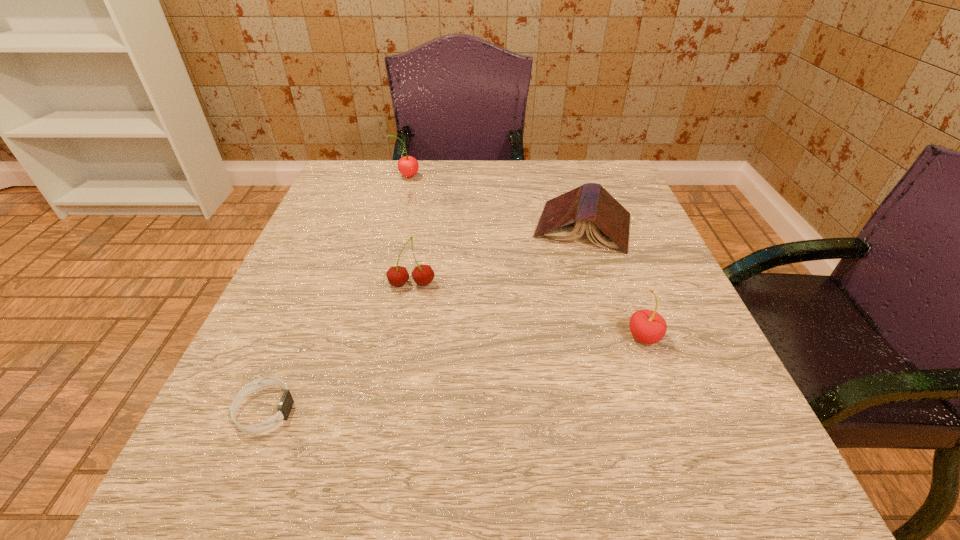
Where is `vacant space located on the front of the rightmost cherry`? vacant space located on the front of the rightmost cherry is located at coordinates (672, 413).

At what (x,y) coordinates should I click in order to perform the action: click on vacant space located on the back of the fourth tallest object. Please return your answer as a coordinate pair (x, y). This screenshot has height=540, width=960. Looking at the image, I should click on (568, 180).

Where is `vacant position located on the outer surface of the nearest object`? vacant position located on the outer surface of the nearest object is located at coordinates click(470, 410).

I want to click on cherry that is positioned at the far edge, so click(x=408, y=166).

You are a GUI agent. You are given a task and a screenshot of the screen. Output one action in this format:
    pyautogui.click(x=<x>, y=<y>)
    Task: Click on the book situated at the far edge
    
    Given the screenshot: What is the action you would take?
    pyautogui.click(x=564, y=218)

I want to click on cherry that is positioned at the left edge, so click(408, 166).

Locate an element on the screen. The width and height of the screenshot is (960, 540). wristband that is at the left edge is located at coordinates click(x=285, y=405).

Where is `cherry at the right edge`? This screenshot has height=540, width=960. cherry at the right edge is located at coordinates (647, 326).

Where is `book present at the right edge`? This screenshot has height=540, width=960. book present at the right edge is located at coordinates (564, 218).

Find the location of `object present at the far left corner`. object present at the far left corner is located at coordinates [408, 166].